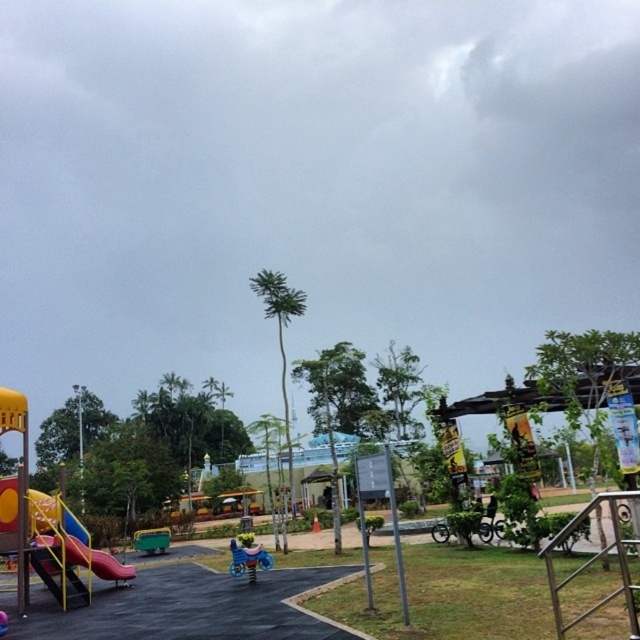
You are a parent trying to decide which play equipment is safer for your child. The yellow matte slide at lower left and the metallic blue swing at center are both options. Based on their heights, which one might be less intimidating for a young child?

The yellow matte slide at lower left is not as tall as the metallic blue swing at center, so it might be less intimidating for a young child.

You are a parent trying to decide which play equipment to let your child use first. You see the yellow matte slide at lower left and the metallic blue swing at center. Which one is smaller in size?

The yellow matte slide at lower left is smaller in size compared to the metallic blue swing at center.

You are standing at the point marked by coordinates (13, 419) in the playground. What object is exactly at this location?

The multicolored plastic playground at lower left is located at point (13, 419).